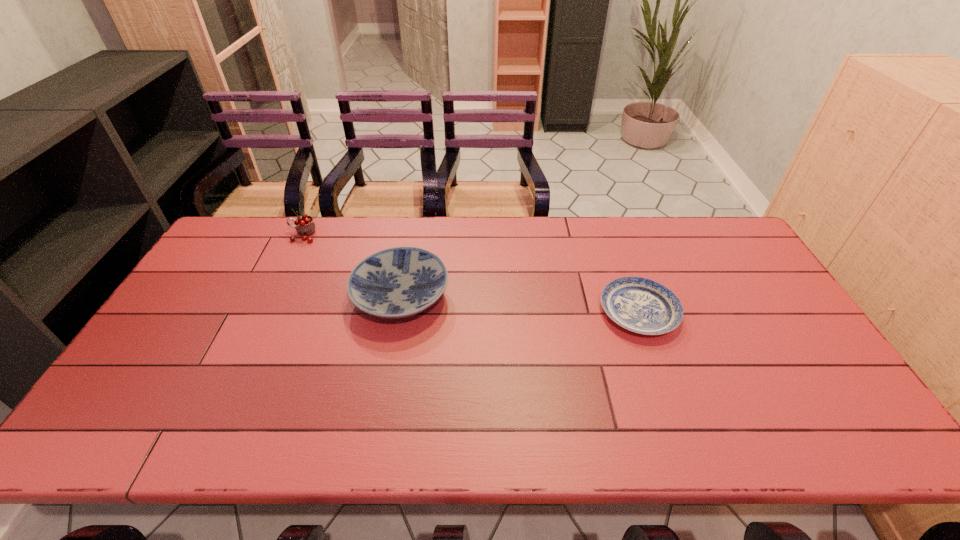
At what (x,y) coordinates should I click in order to perform the action: click on vacant area situated on the right of the shorter plate. Please return your answer as a coordinate pair (x, y). The height and width of the screenshot is (540, 960). Looking at the image, I should click on (703, 312).

Find the location of a particular element. Image resolution: width=960 pixels, height=540 pixels. object that is at the far edge is located at coordinates (305, 226).

Identify the location of vacant space at the far edge. This screenshot has height=540, width=960. (509, 217).

In the image, there is a desktop. Where is `vacant space at the near edge`? This screenshot has width=960, height=540. vacant space at the near edge is located at coordinates (586, 427).

The image size is (960, 540). Find the location of `blank space at the left edge of the desktop`. blank space at the left edge of the desktop is located at coordinates (228, 296).

The image size is (960, 540). In order to click on vacant space at the near left corner of the desktop in this screenshot , I will do `click(91, 440)`.

The image size is (960, 540). In the image, there is a desktop. What are the coordinates of `vacant space at the near right corner` in the screenshot? It's located at (804, 432).

Image resolution: width=960 pixels, height=540 pixels. In order to click on empty location between the second shortest object and the cherry in this screenshot , I will do `click(352, 266)`.

Locate an element on the screen. This screenshot has height=540, width=960. empty space between the cherry and the right plate is located at coordinates (470, 273).

Where is `free space between the tallest object and the shorter plate`? free space between the tallest object and the shorter plate is located at coordinates (470, 273).